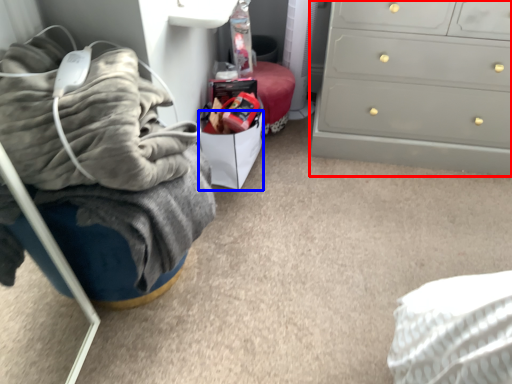
Question: Which point is further to the camera, chest of drawers (highlighted by a red box) or drawer (highlighted by a blue box)?

Choices:
 (A) chest of drawers
 (B) drawer

Answer: (B)